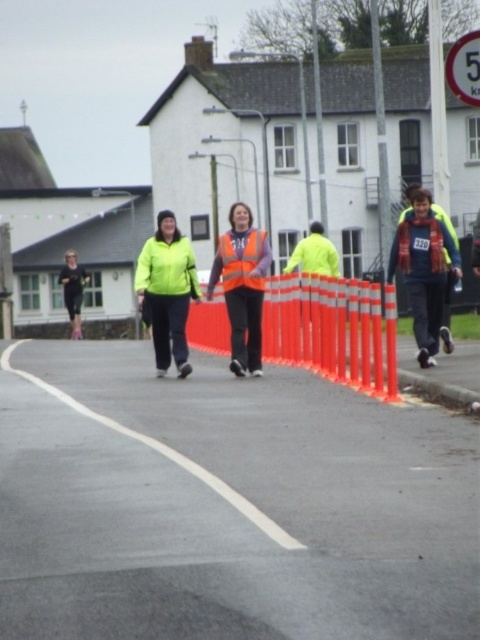
Question: Among these points, which one is nearest to the camera?

Choices:
 (A) (230, 284)
 (B) (477, 54)

Answer: (A)

Question: Considering the relative positions of neon green jacket at center and black running suit at left in the image provided, where is neon green jacket at center located with respect to black running suit at left?

Choices:
 (A) left
 (B) right

Answer: (B)

Question: Can you confirm if reflective orange vest at center is thinner than high visibility fabric safety vest at center?

Choices:
 (A) no
 (B) yes

Answer: (A)

Question: Which point is closer to the camera?

Choices:
 (A) high visibility fabric safety vest at center
 (B) matte yellow jacket at center

Answer: (A)

Question: Is neon green jacket at center below matte yellow jacket at center?

Choices:
 (A) no
 (B) yes

Answer: (B)

Question: Which of the following is the farthest from the observer?

Choices:
 (A) (192, 256)
 (B) (231, 244)

Answer: (A)